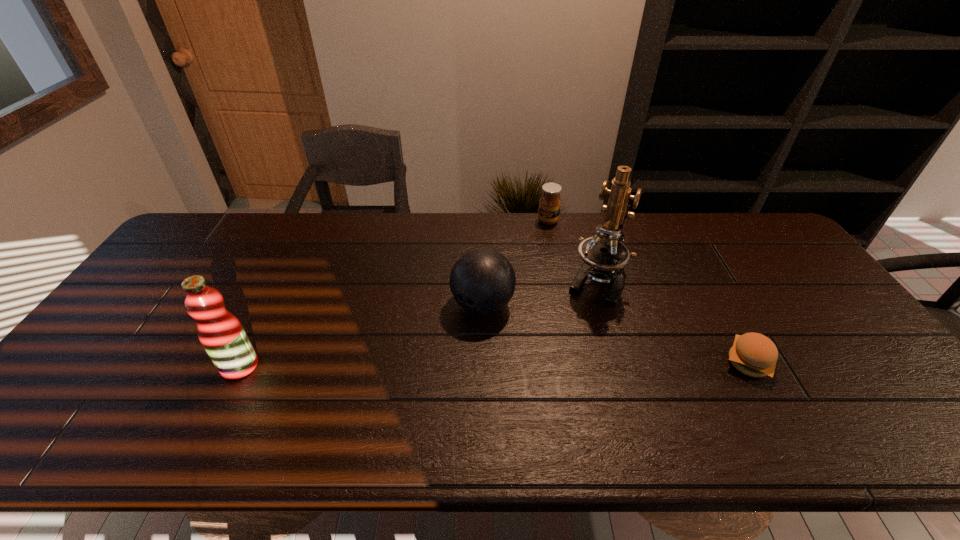
Identify which object is located as the nearest to the tallest object. Please provide its 2D coordinates. Your answer should be formatted as a tuple, i.e. [(x, y)], where the tuple contains the x and y coordinates of a point satisfying the conditions above.

[(549, 205)]

Where is `free spot that satisfies the following two spatial constraints: 1. on the front side of the farthest object; 2. on the left side of the microscope`? The height and width of the screenshot is (540, 960). free spot that satisfies the following two spatial constraints: 1. on the front side of the farthest object; 2. on the left side of the microscope is located at coordinates (560, 280).